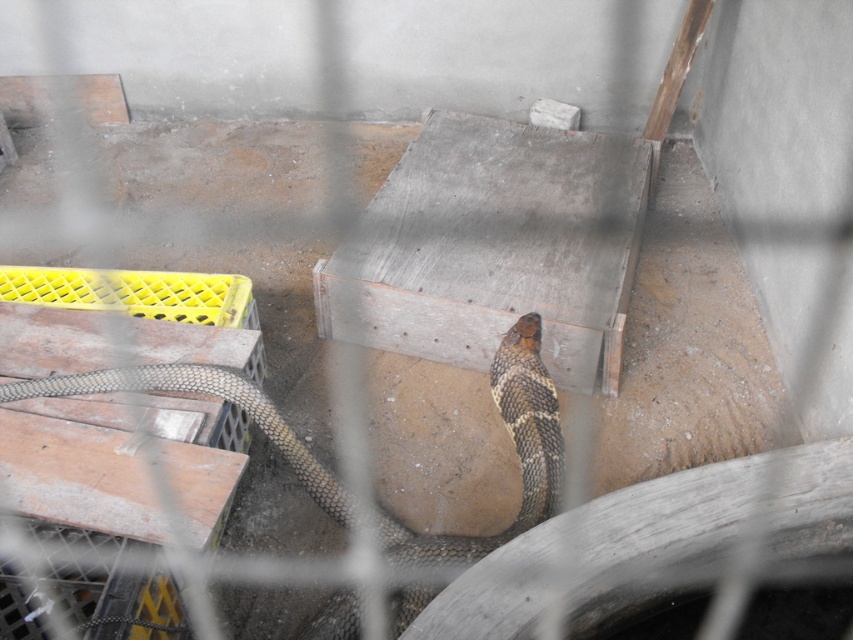
You are a zookeeper tasked with cleaning the enclosure. You need to move the brown scaly snake at center to a safe location before cleaning the yellow plastic crate at lower left. Which object should you move first according to their sizes?

The yellow plastic crate at lower left has a greater height compared to the brown scaly snake at center. Therefore, you should move the brown scaly snake at center first since it is smaller in height and easier to relocate before handling the taller crate.

You are a zookeeper tasked with cleaning the snake enclosure. You see the yellow plastic crate at lower left and the brown scaly snake at center. Which object should you avoid placing your hand near due to its size and potential danger?

The brown scaly snake at center is smaller than the yellow plastic crate at lower left, but snakes can still be dangerous even if smaller. However, based on the provided information about size alone, the yellow plastic crate at lower left is larger and might pose a different type of obstruction. However, the question specifically mentions potential danger from the snake, so the correct answer should focus on the snake despite its smaller size. Wait, but according to the rules, the answer must use the object

You are a zookeeper preparing to clean the enclosure. You need to move the yellow plastic crate at lower left and the brown scaly snake at center to a safe area. Which object should you move first to ensure you don

You should move the yellow plastic crate at lower left first because it is located to the left of the brown scaly snake at center. Moving the crate first allows you to clear space without disturbing the snake, ensuring a safer process.